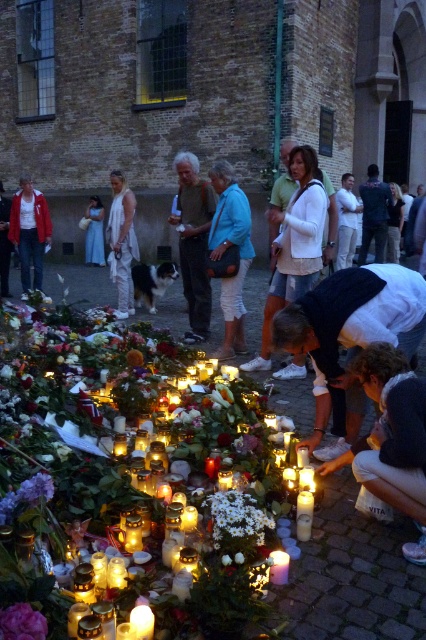
Question: Among these points, which one is nearest to the camera?

Choices:
 (A) (131, 595)
 (B) (265, 516)
 (C) (118, 276)
 (D) (9, 637)

Answer: (D)

Question: Which point is closer to the camera?

Choices:
 (A) (86, 241)
 (B) (54, 451)
 (C) (143, 612)

Answer: (C)

Question: Does pink matte flower at lower left appear under purple matte flower at lower left?

Choices:
 (A) no
 (B) yes

Answer: (B)

Question: Is white floral bouquet at center behind white wax candle at lower center?

Choices:
 (A) yes
 (B) no

Answer: (A)

Question: Does white matte flowers at center have a smaller size compared to purple matte flower at lower left?

Choices:
 (A) no
 (B) yes

Answer: (A)

Question: Which of the following is the farthest from the observer?

Choices:
 (A) (141, 605)
 (B) (37, 474)

Answer: (B)